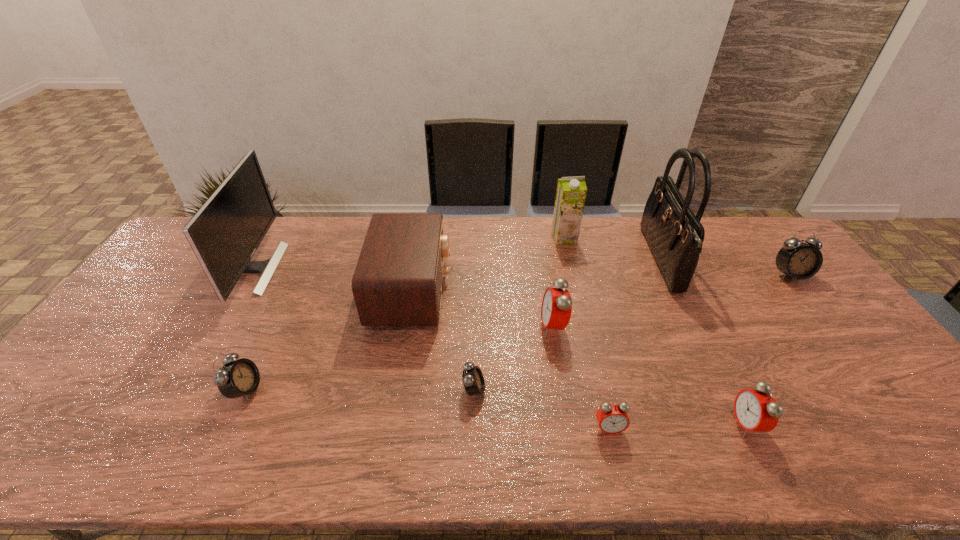
This screenshot has width=960, height=540. Find the location of `the second closest white alarm clock relative to the monitor`. the second closest white alarm clock relative to the monitor is located at coordinates (473, 380).

This screenshot has height=540, width=960. I want to click on the third closest white alarm clock to the radio receiver, so click(796, 259).